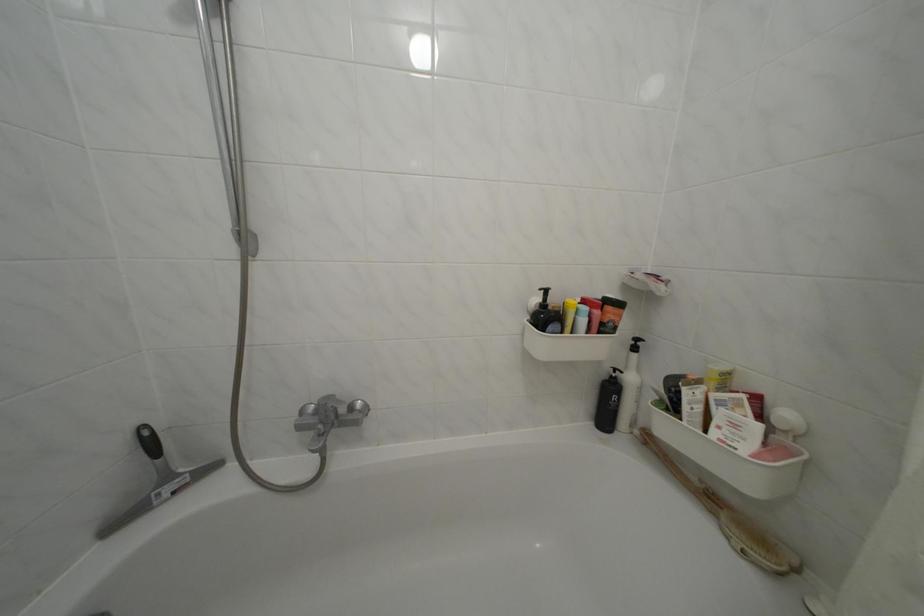
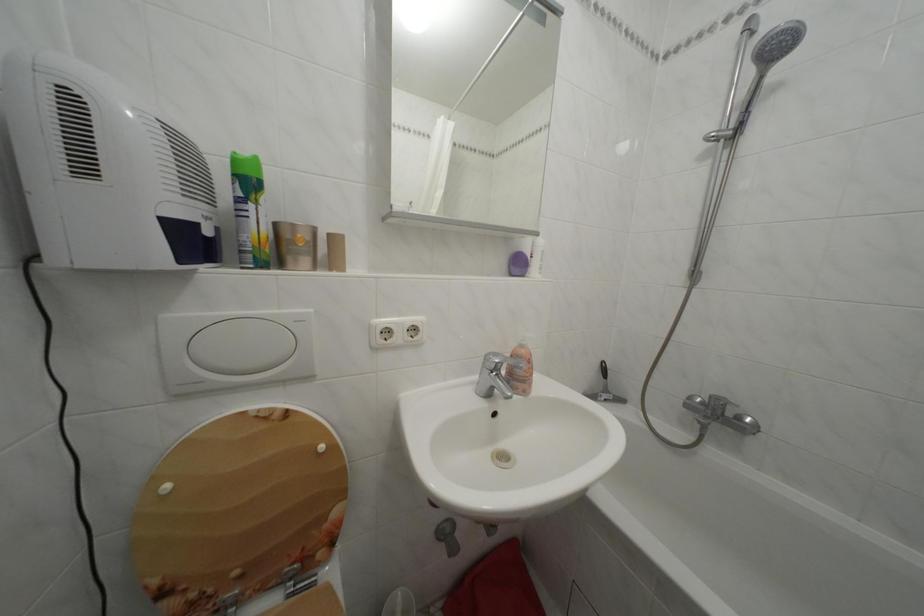
In the second image, find the point that corresponds to point 176,484 in the first image.

(614, 397)